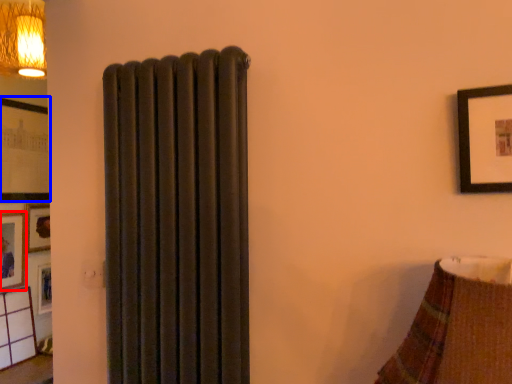
Question: Which object appears closest to the camera in this image, picture frame (highlighted by a red box) or picture frame (highlighted by a blue box)?

Choices:
 (A) picture frame
 (B) picture frame

Answer: (A)